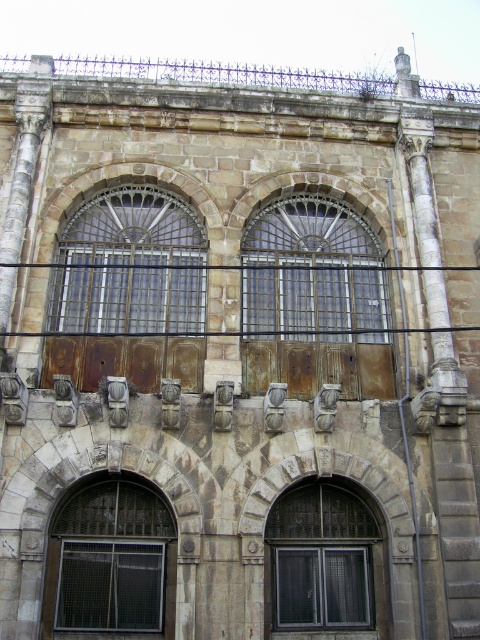
Question: Estimate the real-world distances between objects in this image. Which object is closer to the rusty metal door at center?

Choices:
 (A) rusty wood door at center
 (B) matte glass window at center
 (C) dark brown wooden window at lower left

Answer: (A)

Question: Among these points, which one is nearest to the camera?

Choices:
 (A) (324, 284)
 (B) (99, 520)
 (C) (139, 186)

Answer: (B)

Question: Does rusty metal door at center come behind rusty wood door at center?

Choices:
 (A) yes
 (B) no

Answer: (B)

Question: Can you confirm if rusty metal door at center is bigger than rusty wood door at center?

Choices:
 (A) yes
 (B) no

Answer: (B)

Question: Which object is closer to the camera taking this photo?

Choices:
 (A) matte glass window at center
 (B) rusty wood door at center

Answer: (A)

Question: Does rusty metal door at center appear on the right side of dark brown wooden window at lower left?

Choices:
 (A) no
 (B) yes

Answer: (A)